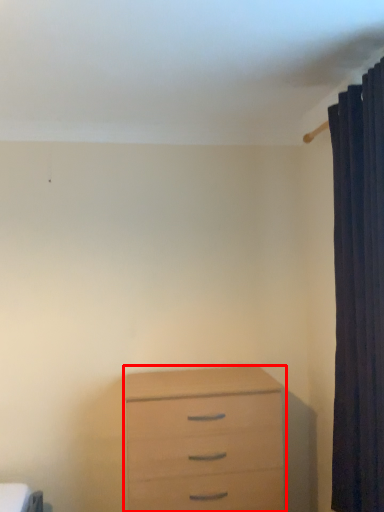
Question: Where is chest of drawers (annotated by the red box) located in relation to curtain in the image?

Choices:
 (A) left
 (B) right

Answer: (A)